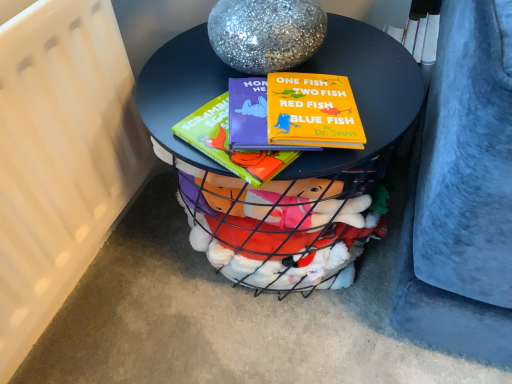
In order to click on matte black table at center in this screenshot , I will do click(x=216, y=162).

Measure the distance between point (309, 179) and camera.

Point (309, 179) is 20.83 inches away from camera.

Image resolution: width=512 pixels, height=384 pixels. Describe the element at coordinates (216, 162) in the screenshot. I see `matte black table at center` at that location.

Describe the element at coordinates (60, 158) in the screenshot. I see `white matte radiator at left` at that location.

You are a GUI agent. You are given a task and a screenshot of the screen. Output one action in this format:
    pyautogui.click(x=<x>, y=<y>)
    Task: Click on the white matte radiator at left
    The image size is (512, 384).
    Given the screenshot: What is the action you would take?
    pyautogui.click(x=60, y=158)

What is the approximate height of white matte radiator at left?

white matte radiator at left is 18.24 inches in height.

Where is `matte black table at center`? This screenshot has width=512, height=384. matte black table at center is located at coordinates (216, 162).

Between matte black table at center and white matte radiator at left, which one appears on the left side from the viewer's perspective?

From the viewer's perspective, white matte radiator at left appears more on the left side.

Between matte black table at center and white matte radiator at left, which one is positioned behind?

matte black table at center.

Between point (410, 107) and point (72, 161), which one is positioned behind?

The point (72, 161) is behind.

From the image's perspective, between matte black table at center and white matte radiator at left, who is located below?

matte black table at center is shown below in the image.

From a real-world perspective, is matte black table at center on white matte radiator at left?

No, from a real-world perspective, matte black table at center is not above white matte radiator at left.

Based on the photo, considering the sizes of objects matte black table at center and white matte radiator at left in the image provided, who is thinner, matte black table at center or white matte radiator at left?

Thinner between the two is white matte radiator at left.

Is matte black table at center shorter than white matte radiator at left?

Correct, matte black table at center is not as tall as white matte radiator at left.

Between matte black table at center and white matte radiator at left, which one has smaller size?

Smaller between the two is white matte radiator at left.

Is matte black table at center spatially inside white matte radiator at left, or outside of it?

matte black table at center is spatially situated outside white matte radiator at left.

Looking at this image, would you say matte black table at center is a long distance from white matte radiator at left?

That's not correct — matte black table at center is a little close to white matte radiator at left.

Is matte black table at center turned away from white matte radiator at left?

No.

What's the angular difference between matte black table at center and white matte radiator at left's facing directions?

They differ by 92.3 degrees in their facing directions.

Where is `radiator above the matte black table at center (from a real-world perspective)`? radiator above the matte black table at center (from a real-world perspective) is located at coordinates (60, 158).

Considering the relative positions of white matte radiator at left and matte black table at center in the image provided, is white matte radiator at left to the right of matte black table at center from the viewer's perspective?

No, white matte radiator at left is not to the right of matte black table at center.

Considering the relative positions of white matte radiator at left and matte black table at center in the image provided, is white matte radiator at left behind matte black table at center?

No, white matte radiator at left is closer to the camera.

Is point (17, 65) less distant than point (353, 36)?

Yes.

From the image's perspective, is white matte radiator at left over matte black table at center?

Correct, white matte radiator at left appears higher than matte black table at center in the image.

From a real-world perspective, between white matte radiator at left and matte black table at center, who is vertically higher?

In real-world perspective, white matte radiator at left is above.

In terms of width, does white matte radiator at left look wider or thinner when compared to matte black table at center?

Considering their sizes, white matte radiator at left looks slimmer than matte black table at center.

Considering the relative sizes of white matte radiator at left and matte black table at center in the image provided, is white matte radiator at left taller than matte black table at center?

Yes, white matte radiator at left is taller than matte black table at center.

Which of these two, white matte radiator at left or matte black table at center, is bigger?

With larger size is matte black table at center.

Do you think white matte radiator at left is within matte black table at center, or outside of it?

white matte radiator at left is not inside matte black table at center, it's outside.

Is white matte radiator at left beside matte black table at center?

white matte radiator at left and matte black table at center are not in contact.

Is white matte radiator at left oriented away from matte black table at center?

white matte radiator at left does not have its back to matte black table at center.

What are the coordinates of `radiator in front of the matte black table at center` in the screenshot? It's located at (60, 158).

The image size is (512, 384). I want to click on table below the white matte radiator at left (from the image's perspective), so click(216, 162).

The height and width of the screenshot is (384, 512). I want to click on radiator above the matte black table at center (from the image's perspective), so click(60, 158).